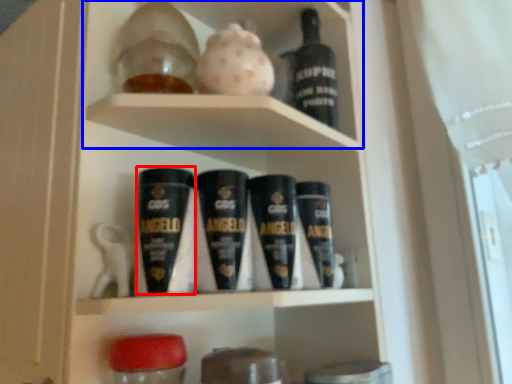
Question: Which object appears closest to the camera in this image, shaving cream (highlighted by a red box) or cabinet (highlighted by a blue box)?

Choices:
 (A) shaving cream
 (B) cabinet

Answer: (A)